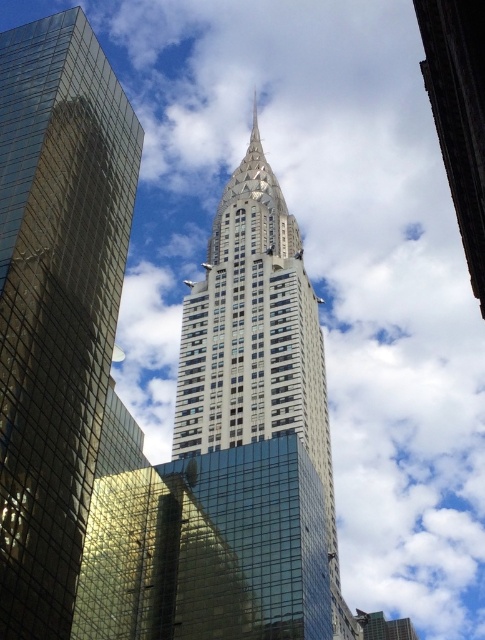
You are a drone operator planning to fly a drone between the glassy steel skyscraper at center and the glassy steel tower at center. The drone has a wingspan of 1.2 meters. Based on the scene, can the drone safely navigate the space between them?

The distance between the glassy steel skyscraper at center and the glassy steel tower at center is 32.53 meters, which is more than sufficient for the drone with a 1.2 meter wingspan to safely navigate between them.

You are an urban planner evaluating the skyline of New York City. You observe the glassy steel skyscraper at center and the glassy steel tower at center. Which of these two structures appears to be the larger one in the image?

The glassy steel tower at center is larger than the glassy steel skyscraper at center.